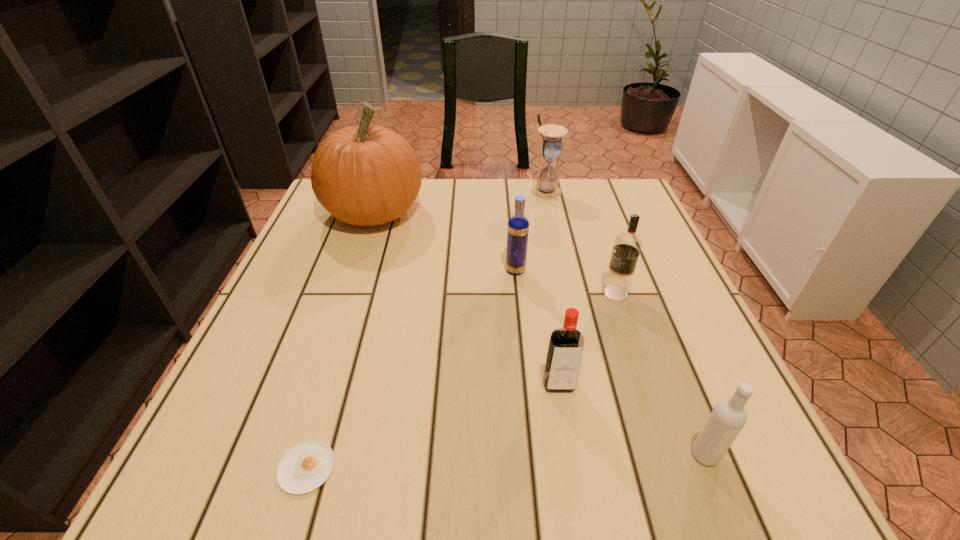
Where is `vacant space in between the egg yolk and the third vodka from right to left`? vacant space in between the egg yolk and the third vodka from right to left is located at coordinates (433, 426).

Locate an element on the screen. vacant area that lies between the second farthest vodka and the rightmost object is located at coordinates (660, 374).

You are a GUI agent. You are given a task and a screenshot of the screen. Output one action in this format:
    pyautogui.click(x=<x>, y=<y>)
    Task: Click on the free spot between the second nearest vodka and the sixth object from left to right
    The image size is (960, 540).
    Given the screenshot: What is the action you would take?
    pyautogui.click(x=588, y=339)

The height and width of the screenshot is (540, 960). I want to click on free space between the tallest object and the shortest object, so click(x=341, y=340).

Where is `the third closest object to the hourglass`? The width and height of the screenshot is (960, 540). the third closest object to the hourglass is located at coordinates (627, 246).

Find the location of `the sixth closest object relative to the second vodka from left to right`. the sixth closest object relative to the second vodka from left to right is located at coordinates (551, 145).

You are a GUI agent. You are given a task and a screenshot of the screen. Output one action in this format:
    pyautogui.click(x=<x>, y=<y>)
    Task: Click on the closest vodka to the shortest object
    
    Given the screenshot: What is the action you would take?
    pyautogui.click(x=565, y=349)

Choose which vodka is the nearest neighbor to the third nearest object. Please provide its 2D coordinates. Your answer should be formatted as a tuple, i.e. [(x, y)], where the tuple contains the x and y coordinates of a point satisfying the conditions above.

[(727, 419)]

Identify the location of free space that satisfies the following two spatial constraints: 1. on the stem of the tallest object; 2. on the left side of the third farthest object. This screenshot has width=960, height=540. (355, 270).

Locate an element on the screen. The image size is (960, 540). vacant space that satisfies the following two spatial constraints: 1. on the back side of the rightmost vodka; 2. on the stem of the pumpkin is located at coordinates (608, 213).